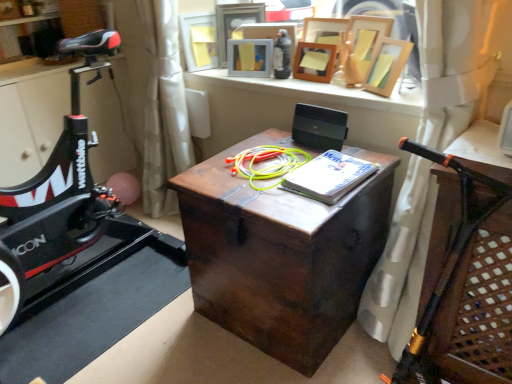
Question: Is wooden picture frame at upper center, which is the first picture frame in left-to-right order, further to camera compared to wooden table at right?

Choices:
 (A) yes
 (B) no

Answer: (A)

Question: Can you confirm if wooden picture frame at upper center, placed as the 6th picture frame when sorted from right to left, is smaller than wooden table at right?

Choices:
 (A) no
 (B) yes

Answer: (B)

Question: Does wooden picture frame at upper center, which is the first picture frame in left-to-right order, have a larger size compared to wooden table at right?

Choices:
 (A) no
 (B) yes

Answer: (A)

Question: Is wooden picture frame at upper center, placed as the 6th picture frame when sorted from right to left, facing away from wooden table at right?

Choices:
 (A) yes
 (B) no

Answer: (B)

Question: Looking at their shapes, would you say wooden table at right is wider or thinner than wooden picture frame at upper center, which is counted as the 5th picture frame, starting from the right?

Choices:
 (A) thin
 (B) wide

Answer: (B)

Question: From a real-world perspective, relative to wooden picture frame at upper center, which ranks as the second picture frame in left-to-right order, is wooden table at right vertically above or below?

Choices:
 (A) below
 (B) above

Answer: (A)

Question: In the image, is wooden table at right positioned in front of or behind wooden picture frame at upper center, which is counted as the 5th picture frame, starting from the right?

Choices:
 (A) front
 (B) behind

Answer: (A)

Question: In terms of size, does wooden table at right appear bigger or smaller than wooden picture frame at upper center, which is counted as the 5th picture frame, starting from the right?

Choices:
 (A) big
 (B) small

Answer: (A)

Question: Looking at their shapes, would you say wooden picture frame at upper center, which ranks as the second picture frame in left-to-right order, is wider or thinner than wooden picture frame at upper center, which is the first picture frame in left-to-right order?

Choices:
 (A) wide
 (B) thin

Answer: (A)

Question: From a real-world perspective, is wooden picture frame at upper center, which ranks as the second picture frame in left-to-right order, physically located above or below wooden picture frame at upper center, which is the first picture frame in left-to-right order?

Choices:
 (A) above
 (B) below

Answer: (A)

Question: Would you say wooden picture frame at upper center, which is counted as the 5th picture frame, starting from the right, is to the left or to the right of wooden picture frame at upper center, which is the first picture frame in left-to-right order, in the picture?

Choices:
 (A) left
 (B) right

Answer: (B)

Question: In terms of size, does wooden picture frame at upper center, which is counted as the 5th picture frame, starting from the right, appear bigger or smaller than wooden picture frame at upper center, which is the first picture frame in left-to-right order?

Choices:
 (A) small
 (B) big

Answer: (B)

Question: In terms of height, does wooden picture frame at upper center, the 5th picture frame when ordered from left to right, look taller or shorter compared to wooden picture frame at upper center, which appears as the sixth picture frame when viewed from the left?

Choices:
 (A) short
 (B) tall

Answer: (B)

Question: From the image's perspective, is wooden picture frame at upper center, the 5th picture frame when ordered from left to right, above or below wooden picture frame at upper center, which appears as the sixth picture frame when viewed from the left?

Choices:
 (A) below
 (B) above

Answer: (B)